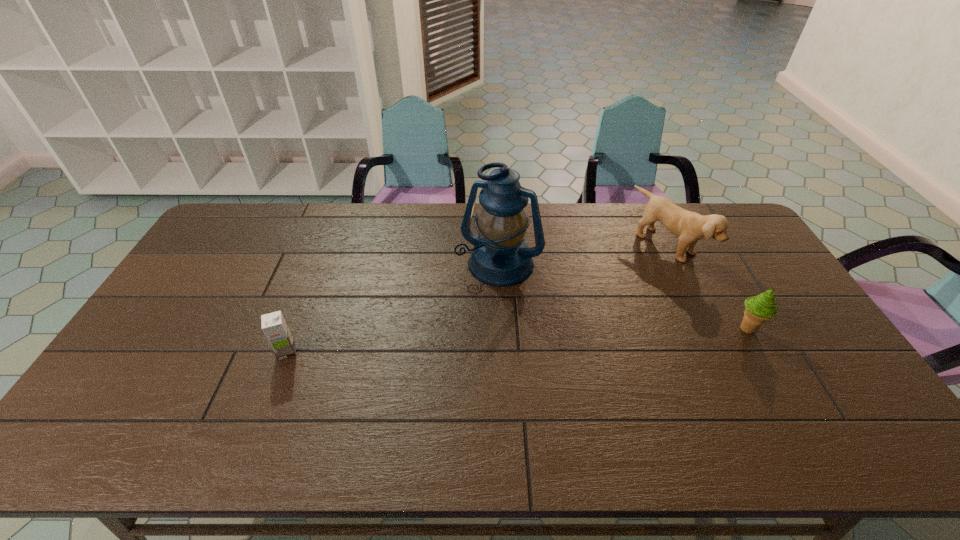
What are the coordinates of `free space on the desktop that is between the nearest object and the icecream and is positioned on the left side of the puppy` in the screenshot? It's located at (531, 339).

This screenshot has width=960, height=540. What are the coordinates of `vacant space on the desktop that is between the leftmost object and the icecream and is positioned on the face of the third object from right to left` in the screenshot? It's located at (459, 343).